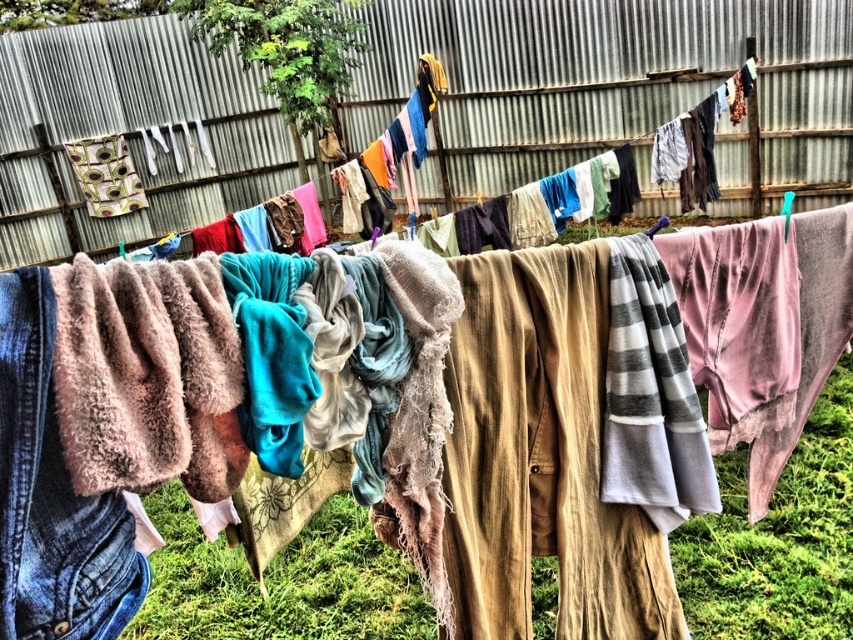
Question: Which of the following is the closest to the observer?

Choices:
 (A) (805, 502)
 (B) (608, 33)

Answer: (A)

Question: Which point appears farthest from the camera in this image?

Choices:
 (A) pyautogui.click(x=51, y=292)
 (B) pyautogui.click(x=38, y=116)
 (C) pyautogui.click(x=190, y=534)

Answer: (B)

Question: Which object is farther from the camera taking this photo?

Choices:
 (A) metallic corrugated fence at upper center
 (B) denim at left
 (C) fuzzy beige blanket at center

Answer: (A)

Question: Is metallic corrugated fence at upper center bigger than fuzzy beige blanket at center?

Choices:
 (A) no
 (B) yes

Answer: (B)

Question: Can you confirm if metallic corrugated fence at upper center is thinner than denim at left?

Choices:
 (A) yes
 (B) no

Answer: (B)

Question: Does metallic corrugated fence at upper center have a smaller size compared to denim at left?

Choices:
 (A) yes
 (B) no

Answer: (B)